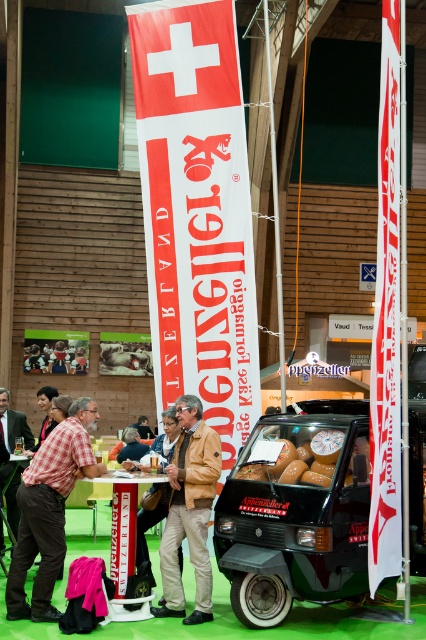
Question: Which of the following is the farthest from the observer?

Choices:
 (A) green matte car at center
 (B) brown leather jacket at center

Answer: (B)

Question: Which is farther from the brown leather jacket at center?

Choices:
 (A) green matte car at center
 (B) plaid shirt at center
 (C) checkered fabric shirt at center

Answer: (C)

Question: Is the position of plaid shirt at center more distant than that of checkered fabric shirt at center?

Choices:
 (A) no
 (B) yes

Answer: (A)

Question: Does plaid shirt at center have a lesser width compared to brown leather jacket at center?

Choices:
 (A) no
 (B) yes

Answer: (A)

Question: Which point is closer to the camera taking this photo?

Choices:
 (A) (5, 465)
 (B) (34, 490)
 (C) (210, 484)

Answer: (B)

Question: Does green matte car at center appear under checkered fabric shirt at center?

Choices:
 (A) yes
 (B) no

Answer: (B)